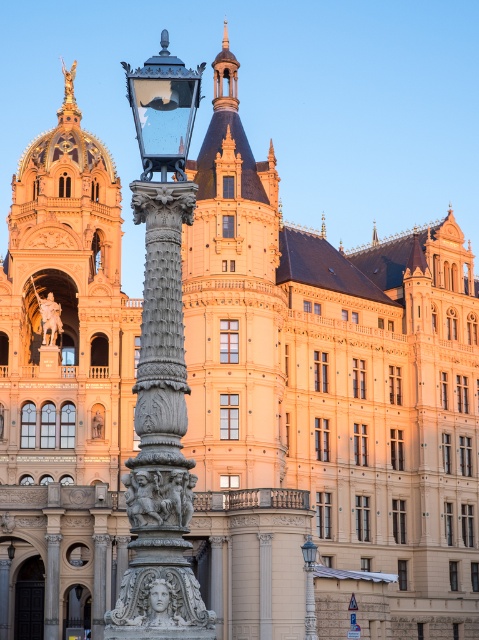
You are a GUI agent. You are given a task and a screenshot of the screen. Output one action in this format:
    pyautogui.click(x=<x>, y=<y>)
    Task: Click on the polished bronze lamp post at center
    This screenshot has height=640, width=479.
    Given the screenshot: What is the action you would take?
    pyautogui.click(x=160, y=356)

What do you see at coordinates (160, 356) in the screenshot? This screenshot has width=479, height=640. I see `polished bronze lamp post at center` at bounding box center [160, 356].

I want to click on polished bronze lamp post at center, so click(x=160, y=356).

What do you see at coordinates (160, 356) in the screenshot? I see `polished bronze lamp post at center` at bounding box center [160, 356].

Is point (150, 83) less distant than point (159, 493)?

No, it is behind (159, 493).

Between point (173, 340) and point (148, 509), which one is positioned behind?

The point (173, 340) is more distant.

Find the location of a particular element. polished bronze lamp post at center is located at coordinates (160, 356).

Which is in front, point (159, 474) or point (43, 326)?

Positioned in front is point (159, 474).

Who is higher up, carved stone sculpture at center or bronze statue at center?

bronze statue at center

Locate an element on the screen. The width and height of the screenshot is (479, 640). carved stone sculpture at center is located at coordinates (159, 497).

The image size is (479, 640). I want to click on carved stone sculpture at center, so click(x=159, y=497).